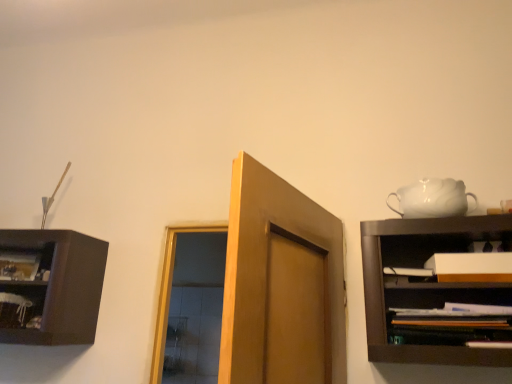
Question: Considering the positions of wooden shelf at right, placed as the second shelf when sorted from back to front, and wooden shelf at left, acting as the 1th shelf starting from the back, in the image, is wooden shelf at right, placed as the second shelf when sorted from back to front, wider or thinner than wooden shelf at left, acting as the 1th shelf starting from the back,?

Choices:
 (A) wide
 (B) thin

Answer: (B)

Question: Considering the positions of wooden shelf at right, the 1th shelf viewed from the front, and wooden shelf at left, acting as the 1th shelf starting from the back, in the image, is wooden shelf at right, the 1th shelf viewed from the front, bigger or smaller than wooden shelf at left, acting as the 1th shelf starting from the back,?

Choices:
 (A) small
 (B) big

Answer: (B)

Question: Which is farther from the white matte cabinet at right?

Choices:
 (A) wooden shelf at left, which is the second shelf in front-to-back order
 (B) wooden shelf at right, which is the 1th shelf in right-to-left order
 (C) white glossy teapot at upper right

Answer: (A)

Question: Considering the real-world distances, which object is farthest from the wooden shelf at left, the 1th shelf from the left?

Choices:
 (A) wooden shelf at right, the 1th shelf viewed from the front
 (B) white matte cabinet at right
 (C) white glossy teapot at upper right

Answer: (C)